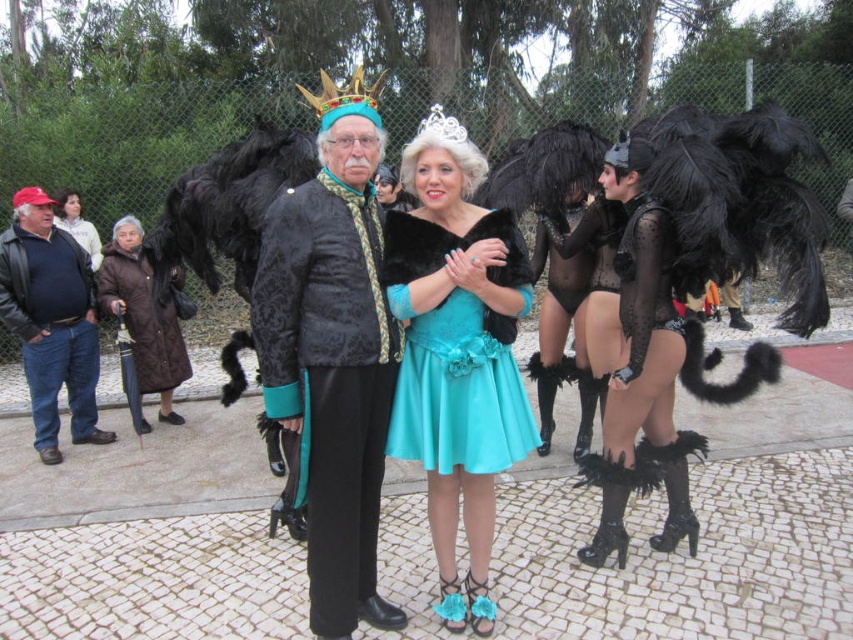
You are a photographer at the event and want to capture both the satin teal dress at center and the gold jeweled crown at center in a single frame. Which object should you position closer to the left side of your camera viewfinder to ensure both are visible?

To ensure both the satin teal dress at center and the gold jeweled crown at center are visible, position the gold jeweled crown at center closer to the left side of the camera viewfinder since the satin teal dress at center is to the right of it.

You are standing in the crowd watching the parade and want to take a photo of the satin teal dress at center. If your camera has a minimum focus distance of 3 meters, will you be able to capture the dress clearly?

The satin teal dress at center and viewer are 2.88 meters apart, which is less than the camera minimum focus distance of 3 meters. Therefore, the camera cannot focus properly, and the photo may be blurry.